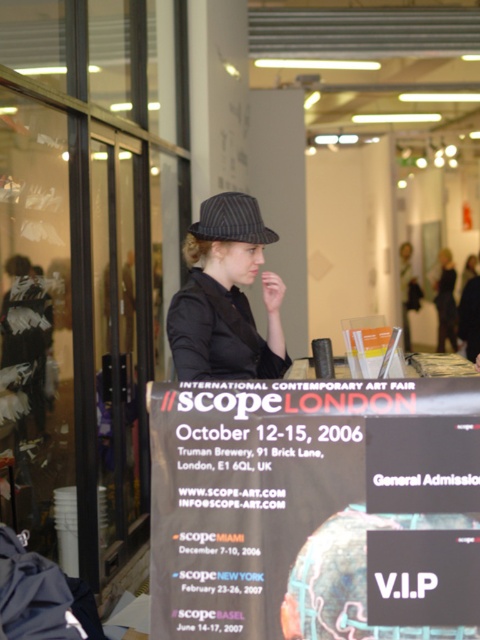
Does striped fabric hat at center appear under striped fabric baseball hat at center?

Correct, striped fabric hat at center is located below striped fabric baseball hat at center.

Consider the image. Is striped fabric hat at center to the right of striped fabric baseball hat at center from the viewer's perspective?

In fact, striped fabric hat at center is to the left of striped fabric baseball hat at center.

The height and width of the screenshot is (640, 480). Find the location of `striped fabric hat at center`. striped fabric hat at center is located at coordinates (226, 296).

Identify the location of striped fabric hat at center. The height and width of the screenshot is (640, 480). (226, 296).